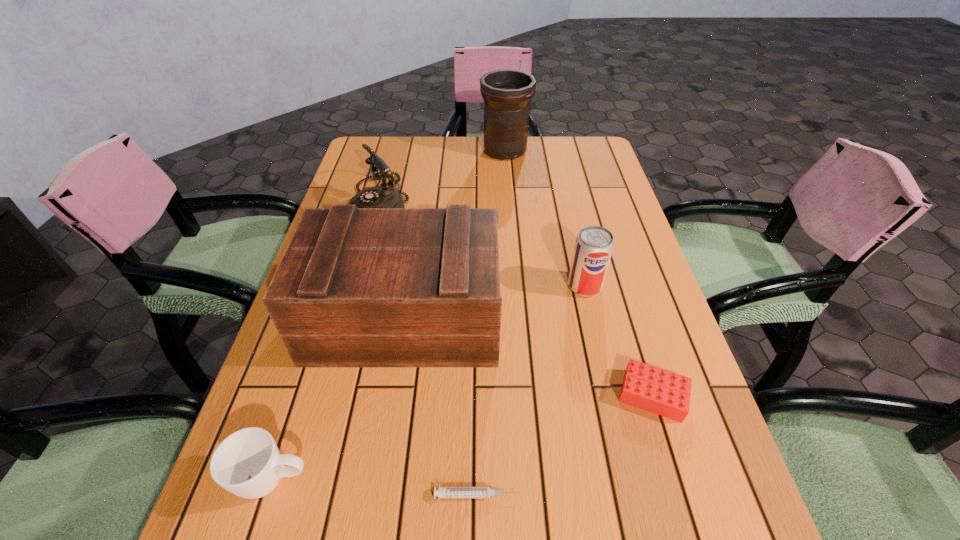
Where is `free area in between the sixth tallest object and the telephone`? The height and width of the screenshot is (540, 960). free area in between the sixth tallest object and the telephone is located at coordinates (516, 298).

Identify which object is the fifth nearest to the telephoto lens. Please provide its 2D coordinates. Your answer should be formatted as a tuple, i.e. [(x, y)], where the tuple contains the x and y coordinates of a point satisfying the conditions above.

[(247, 463)]

Find the location of a particular element. The width and height of the screenshot is (960, 540). the fourth closest object to the telephoto lens is located at coordinates (653, 389).

The width and height of the screenshot is (960, 540). I want to click on vacant point that satisfies the following two spatial constraints: 1. on the back side of the telephone; 2. on the right side of the telephoto lens, so click(395, 151).

The width and height of the screenshot is (960, 540). Identify the location of free location that satisfies the following two spatial constraints: 1. on the front side of the telephoto lens; 2. at the needle end of the shortest object. (532, 495).

At what (x,y) coordinates should I click in order to perform the action: click on vacant space that satisfies the following two spatial constraints: 1. on the front side of the telephoto lens; 2. at the needle end of the syringe. Please return your answer as a coordinate pair (x, y). Looking at the image, I should click on (532, 495).

You are a GUI agent. You are given a task and a screenshot of the screen. Output one action in this format:
    pyautogui.click(x=<x>, y=<y>)
    Task: Click on the free space that satisfies the following two spatial constraints: 1. on the front side of the Lego; 2. at the needle end of the shortest object
    This screenshot has height=540, width=960.
    Given the screenshot: What is the action you would take?
    pyautogui.click(x=684, y=495)

The image size is (960, 540). I want to click on vacant position in the image that satisfies the following two spatial constraints: 1. on the front side of the soda; 2. at the needle end of the syringe, so click(x=634, y=495).